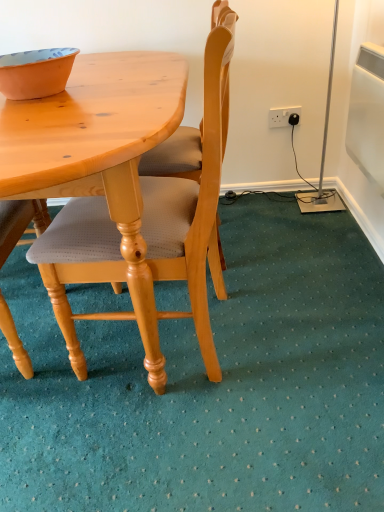
This screenshot has width=384, height=512. Find the location of `vacant space to the right of light wood/light brown chair at center`. vacant space to the right of light wood/light brown chair at center is located at coordinates (310, 335).